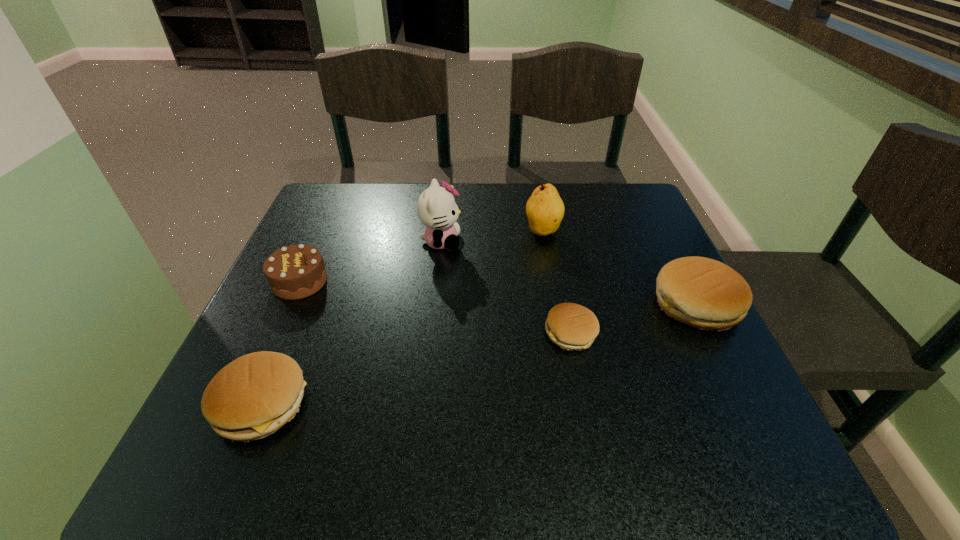
Select which patty is the second closest to the fifth tallest object. Please provide its 2D coordinates. Your answer should be formatted as a tuple, i.e. [(x, y)], where the tuple contains the x and y coordinates of a point satisfying the conditions above.

[(704, 293)]

The image size is (960, 540). Identify the location of patty that is the closest one to the kitten. (571, 326).

Where is `vacant area in the image that satisfies the following two spatial constraints: 1. on the front side of the nearest patty; 2. on the left side of the chocolate cake`? The height and width of the screenshot is (540, 960). vacant area in the image that satisfies the following two spatial constraints: 1. on the front side of the nearest patty; 2. on the left side of the chocolate cake is located at coordinates (245, 404).

I want to click on vacant space that satisfies the following two spatial constraints: 1. on the front-facing side of the third object from left to right; 2. on the left side of the second patty from right to left, so click(x=431, y=333).